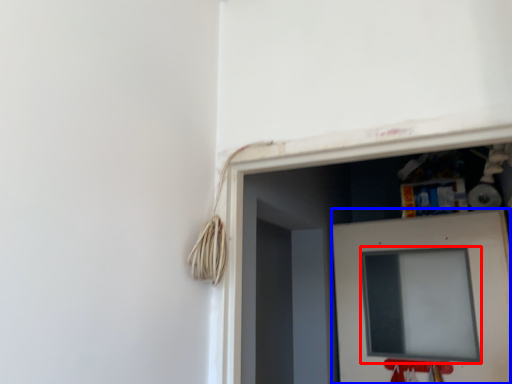
Question: Which point is further to the camera, computer screen (highlighted by a red box) or door (highlighted by a blue box)?

Choices:
 (A) computer screen
 (B) door

Answer: (A)